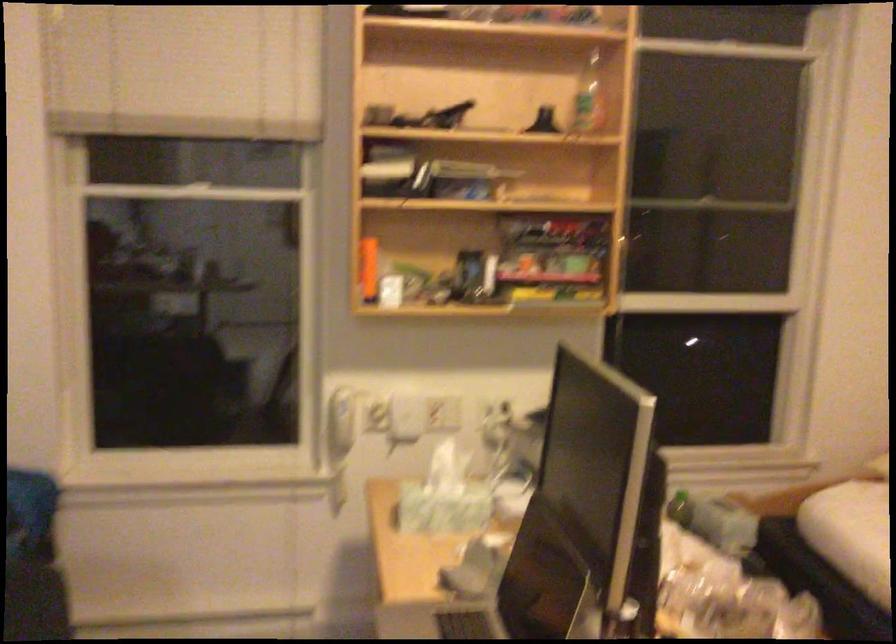
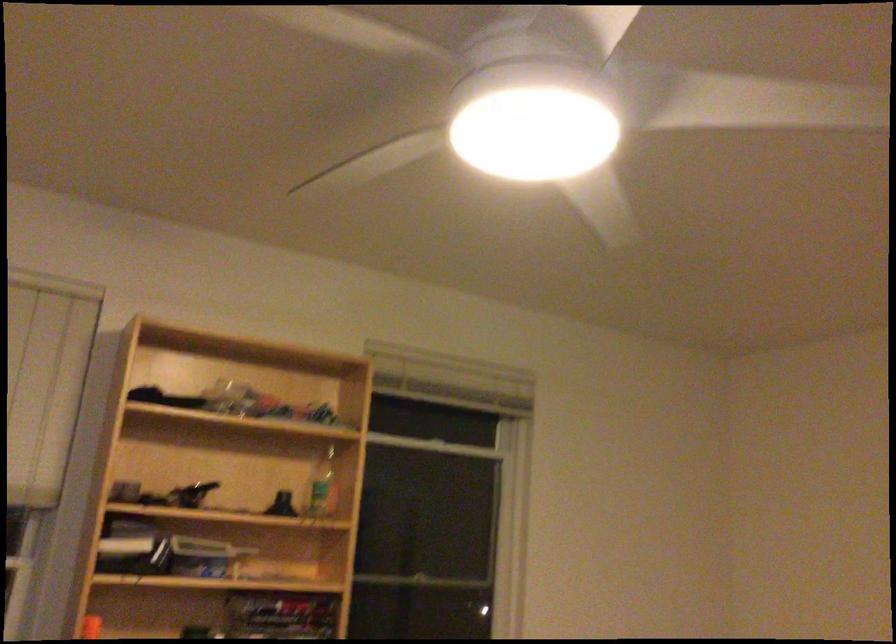
In the second image, find the point that corresponds to point (590, 108) in the first image.

(323, 486)